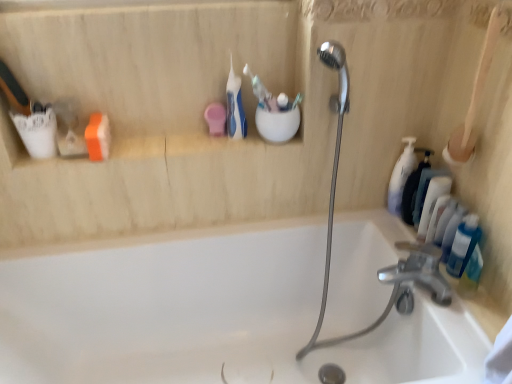
Identify the location of white plastic toothbrushes at right, which is the third toiletry in left-to-right order. The image size is (512, 384). [x=432, y=202].

This screenshot has height=384, width=512. Describe the element at coordinates (413, 187) in the screenshot. I see `white glossy soap dispenser at right, the fourth toiletry from the right` at that location.

Find the location of a particular element. The width and height of the screenshot is (512, 384). blue plastic toothbrush at upper center, the second toothbrush in the right-to-left sequence is located at coordinates (258, 89).

What do you see at coordinates (471, 274) in the screenshot? Image resolution: width=512 pixels, height=384 pixels. I see `blue translucent bottle at right, which is the 2th toiletry from right to left` at bounding box center [471, 274].

Image resolution: width=512 pixels, height=384 pixels. I want to click on white plastic toothbrushes at right, which is the third toiletry in left-to-right order, so click(432, 202).

Measure the distance between translucent plastic toothbrush at upper center, acting as the first toothbrush starting from the right, and white plastic toothbrushes at right, which is the third toiletry in left-to-right order.

translucent plastic toothbrush at upper center, acting as the first toothbrush starting from the right, is 19.26 inches from white plastic toothbrushes at right, which is the third toiletry in left-to-right order.

Is translucent plastic toothbrush at upper center, positioned as the 3th toothbrush in left-to-right order, wider than white plastic toothbrushes at right, marked as the third toiletry in a right-to-left arrangement?

Incorrect, the width of translucent plastic toothbrush at upper center, positioned as the 3th toothbrush in left-to-right order, does not surpass that of white plastic toothbrushes at right, marked as the third toiletry in a right-to-left arrangement.

In the scene shown: Is translucent plastic toothbrush at upper center, positioned as the 3th toothbrush in left-to-right order, bigger than white plastic toothbrushes at right, which is the third toiletry in left-to-right order?

Incorrect, translucent plastic toothbrush at upper center, positioned as the 3th toothbrush in left-to-right order, is not larger than white plastic toothbrushes at right, which is the third toiletry in left-to-right order.

Considering the relative positions of translucent plastic toothbrush at upper center, positioned as the 3th toothbrush in left-to-right order, and white plastic toothbrushes at right, marked as the third toiletry in a right-to-left arrangement, in the image provided, is translucent plastic toothbrush at upper center, positioned as the 3th toothbrush in left-to-right order, in front of white plastic toothbrushes at right, marked as the third toiletry in a right-to-left arrangement,?

Yes, the depth of translucent plastic toothbrush at upper center, positioned as the 3th toothbrush in left-to-right order, is less than that of white plastic toothbrushes at right, marked as the third toiletry in a right-to-left arrangement.

Consider the image. Is translucent plastic bottles at right, acting as the fifth toiletry starting from the left, closer to the viewer compared to blue plastic toothbrush at center, the 3th toothbrush in the right-to-left sequence?

Yes, translucent plastic bottles at right, acting as the fifth toiletry starting from the left, is closer to the camera.

Can you confirm if translucent plastic bottles at right, acting as the fifth toiletry starting from the left, is wider than blue plastic toothbrush at center, the 1th toothbrush when ordered from left to right?

No, translucent plastic bottles at right, acting as the fifth toiletry starting from the left, is not wider than blue plastic toothbrush at center, the 1th toothbrush when ordered from left to right.

From the image's perspective, is translucent plastic bottles at right, acting as the fifth toiletry starting from the left, under blue plastic toothbrush at center, the 1th toothbrush when ordered from left to right?

Yes, from the image's perspective, translucent plastic bottles at right, acting as the fifth toiletry starting from the left, is beneath blue plastic toothbrush at center, the 1th toothbrush when ordered from left to right.

Does translucent plastic bottles at right, acting as the fifth toiletry starting from the left, have a smaller size compared to blue plastic toothbrush at center, the 3th toothbrush in the right-to-left sequence?

Indeed, translucent plastic bottles at right, acting as the fifth toiletry starting from the left, has a smaller size compared to blue plastic toothbrush at center, the 3th toothbrush in the right-to-left sequence.

Is blue plastic toothbrush at center, the 3th toothbrush in the right-to-left sequence, taller than white plastic toothbrushes at right, marked as the third toiletry in a right-to-left arrangement?

Indeed, blue plastic toothbrush at center, the 3th toothbrush in the right-to-left sequence, has a greater height compared to white plastic toothbrushes at right, marked as the third toiletry in a right-to-left arrangement.

Is blue plastic toothbrush at center, the 3th toothbrush in the right-to-left sequence, facing away from white plastic toothbrushes at right, which is the third toiletry in left-to-right order?

No, blue plastic toothbrush at center, the 3th toothbrush in the right-to-left sequence, is not facing the opposite direction of white plastic toothbrushes at right, which is the third toiletry in left-to-right order.

Is blue plastic toothbrush at center, the 3th toothbrush in the right-to-left sequence, not within white plastic toothbrushes at right, which is the third toiletry in left-to-right order?

Yes, blue plastic toothbrush at center, the 3th toothbrush in the right-to-left sequence, is not within white plastic toothbrushes at right, which is the third toiletry in left-to-right order.

Is blue plastic toothbrush at center, the 3th toothbrush in the right-to-left sequence, bigger than translucent plastic bottles at right, acting as the fifth toiletry starting from the left?

Correct, blue plastic toothbrush at center, the 3th toothbrush in the right-to-left sequence, is larger in size than translucent plastic bottles at right, acting as the fifth toiletry starting from the left.

How many degrees apart are the facing directions of blue plastic toothbrush at center, the 1th toothbrush when ordered from left to right, and translucent plastic bottles at right, arranged as the first toiletry when viewed from the right?

The angular difference between blue plastic toothbrush at center, the 1th toothbrush when ordered from left to right, and translucent plastic bottles at right, arranged as the first toiletry when viewed from the right, is 89.9 degrees.

Consider the image. Considering the positions of objects blue plastic toothbrush at center, the 3th toothbrush in the right-to-left sequence, and translucent plastic bottles at right, acting as the fifth toiletry starting from the left, in the image provided, who is more to the left, blue plastic toothbrush at center, the 3th toothbrush in the right-to-left sequence, or translucent plastic bottles at right, acting as the fifth toiletry starting from the left,?

blue plastic toothbrush at center, the 3th toothbrush in the right-to-left sequence.

Is blue plastic toothbrush at center, the 3th toothbrush in the right-to-left sequence, touching translucent plastic bottles at right, arranged as the first toiletry when viewed from the right?

No, blue plastic toothbrush at center, the 3th toothbrush in the right-to-left sequence, is not touching translucent plastic bottles at right, arranged as the first toiletry when viewed from the right.

Considering the relative positions of blue translucent bottle at right, which is the 2th toiletry from right to left, and white glossy bathtub at center in the image provided, is blue translucent bottle at right, which is the 2th toiletry from right to left, to the left or to the right of white glossy bathtub at center?

Clearly, blue translucent bottle at right, which is the 2th toiletry from right to left, is on the right of white glossy bathtub at center in the image.

From a real-world perspective, is blue translucent bottle at right, which is the 2th toiletry from right to left, physically located above or below white glossy bathtub at center?

blue translucent bottle at right, which is the 2th toiletry from right to left, is situated higher than white glossy bathtub at center in the real world.

Looking at this image, can you confirm if blue translucent bottle at right, which is the 2th toiletry from right to left, is smaller than white glossy bathtub at center?

Indeed, blue translucent bottle at right, which is the 2th toiletry from right to left, has a smaller size compared to white glossy bathtub at center.

Identify the location of the 1st toiletry behind the white glossy bathtub at center. (471, 274).

Is white plastic toothbrushes at right, marked as the third toiletry in a right-to-left arrangement, thinner than white matte pump bottle at right, which is counted as the 5th toiletry, starting from the right?

In fact, white plastic toothbrushes at right, marked as the third toiletry in a right-to-left arrangement, might be wider than white matte pump bottle at right, which is counted as the 5th toiletry, starting from the right.

Which is correct: white plastic toothbrushes at right, marked as the third toiletry in a right-to-left arrangement, is inside white matte pump bottle at right, which is counted as the 5th toiletry, starting from the right, or outside of it?

white plastic toothbrushes at right, marked as the third toiletry in a right-to-left arrangement, is not enclosed by white matte pump bottle at right, which is counted as the 5th toiletry, starting from the right.

Is white plastic toothbrushes at right, marked as the third toiletry in a right-to-left arrangement, oriented away from white matte pump bottle at right, which is counted as the 5th toiletry, starting from the right?

white plastic toothbrushes at right, marked as the third toiletry in a right-to-left arrangement, is not turned away from white matte pump bottle at right, which is counted as the 5th toiletry, starting from the right.

Which of these two, white plastic toothbrushes at right, which is the third toiletry in left-to-right order, or white matte pump bottle at right, the first toiletry viewed from the left, is smaller?

white plastic toothbrushes at right, which is the third toiletry in left-to-right order, is smaller.

At what (x,y) coordinates should I click in order to perform the action: click on the 5th toiletry to the right when counting from the translucent plastic toothbrush at upper center, acting as the first toothbrush starting from the right. Please return your answer as a coordinate pair (x, y). Looking at the image, I should click on (463, 245).

Would you say translucent plastic toothbrush at upper center, positioned as the 3th toothbrush in left-to-right order, is to the left or to the right of translucent plastic bottles at right, arranged as the first toiletry when viewed from the right, in the picture?

From the image, it's evident that translucent plastic toothbrush at upper center, positioned as the 3th toothbrush in left-to-right order, is to the left of translucent plastic bottles at right, arranged as the first toiletry when viewed from the right.

From the image's perspective, which is below, translucent plastic toothbrush at upper center, positioned as the 3th toothbrush in left-to-right order, or translucent plastic bottles at right, arranged as the first toiletry when viewed from the right?

translucent plastic bottles at right, arranged as the first toiletry when viewed from the right, appears lower in the image.

Is translucent plastic toothbrush at upper center, positioned as the 3th toothbrush in left-to-right order, not close to translucent plastic bottles at right, acting as the fifth toiletry starting from the left?

translucent plastic toothbrush at upper center, positioned as the 3th toothbrush in left-to-right order, is near translucent plastic bottles at right, acting as the fifth toiletry starting from the left, not far away.

From a real-world perspective, count 2nd toothbrushs upward from the white plastic toothbrushes at right, which is the third toiletry in left-to-right order, and point to it. Please provide its 2D coordinates.

[(297, 100)]

Find the location of a particular element. the 2nd toothbrush behind the translucent plastic bottles at right, acting as the fifth toiletry starting from the left is located at coordinates (234, 107).

From the image, which object appears to be farther from blue translucent bottle at right, the fourth toiletry when ordered from left to right, translucent plastic bottles at right, arranged as the first toiletry when viewed from the right, or blue plastic toothbrush at upper center, the second toothbrush in the right-to-left sequence?

blue plastic toothbrush at upper center, the second toothbrush in the right-to-left sequence, is positioned further to the anchor blue translucent bottle at right, the fourth toiletry when ordered from left to right.

Based on their spatial positions, is blue translucent bottle at right, which is the 2th toiletry from right to left, or wooden handle brush at right further from blue plastic toothbrush at upper center, marked as the 2th toothbrush in a left-to-right arrangement?

The object further to blue plastic toothbrush at upper center, marked as the 2th toothbrush in a left-to-right arrangement, is blue translucent bottle at right, which is the 2th toiletry from right to left.

Which object lies further to the anchor point blue translucent bottle at right, the fourth toiletry when ordered from left to right, wooden handle brush at right or white glossy bathtub at center?

white glossy bathtub at center.

Estimate the real-world distances between objects in this image. Which object is further from wooden handle brush at right, blue translucent bottle at right, the fourth toiletry when ordered from left to right, or white matte pump bottle at right, the first toiletry viewed from the left?

blue translucent bottle at right, the fourth toiletry when ordered from left to right, lies further to wooden handle brush at right than the other object.

Which object lies further to the anchor point white glossy soap dispenser at right, the fourth toiletry from the right, white matte pump bottle at right, which is counted as the 5th toiletry, starting from the right, or blue plastic toothbrush at upper center, marked as the 2th toothbrush in a left-to-right arrangement?

blue plastic toothbrush at upper center, marked as the 2th toothbrush in a left-to-right arrangement.

From the picture: Considering their positions, is blue translucent bottle at right, the fourth toiletry when ordered from left to right, positioned further to blue plastic toothbrush at upper center, the second toothbrush in the right-to-left sequence, than white glossy bathtub at center?

Among the two, white glossy bathtub at center is located further to blue plastic toothbrush at upper center, the second toothbrush in the right-to-left sequence.

When comparing their distances from blue translucent bottle at right, which is the 2th toiletry from right to left, does white plastic toothbrushes at right, which is the third toiletry in left-to-right order, or white glossy soap dispenser at right, acting as the second toiletry starting from the left, seem closer?

Based on the image, white plastic toothbrushes at right, which is the third toiletry in left-to-right order, appears to be nearer to blue translucent bottle at right, which is the 2th toiletry from right to left.

From the picture: Which object lies nearer to the anchor point translucent plastic toothbrush at upper center, acting as the first toothbrush starting from the right, blue translucent bottle at right, the fourth toiletry when ordered from left to right, or blue plastic toothbrush at upper center, the second toothbrush in the right-to-left sequence?

blue plastic toothbrush at upper center, the second toothbrush in the right-to-left sequence.

Locate an element on the screen. This screenshot has width=512, height=384. toiletry between translucent plastic bottles at right, acting as the fifth toiletry starting from the left, and white glossy soap dispenser at right, the fourth toiletry from the right, along the z-axis is located at coordinates (432, 202).

The width and height of the screenshot is (512, 384). Identify the location of toiletry that lies between white plastic toothbrushes at right, which is the third toiletry in left-to-right order, and blue translucent bottle at right, which is the 2th toiletry from right to left, from top to bottom. (463, 245).

The image size is (512, 384). I want to click on toothbrush between blue plastic toothbrush at upper center, the second toothbrush in the right-to-left sequence, and wooden handle brush at right from left to right, so point(297,100).

In order to click on brush between blue plastic toothbrush at center, the 1th toothbrush when ordered from left to right, and translucent plastic bottles at right, acting as the fifth toiletry starting from the left, in the horizontal direction in this screenshot , I will do `click(474, 97)`.